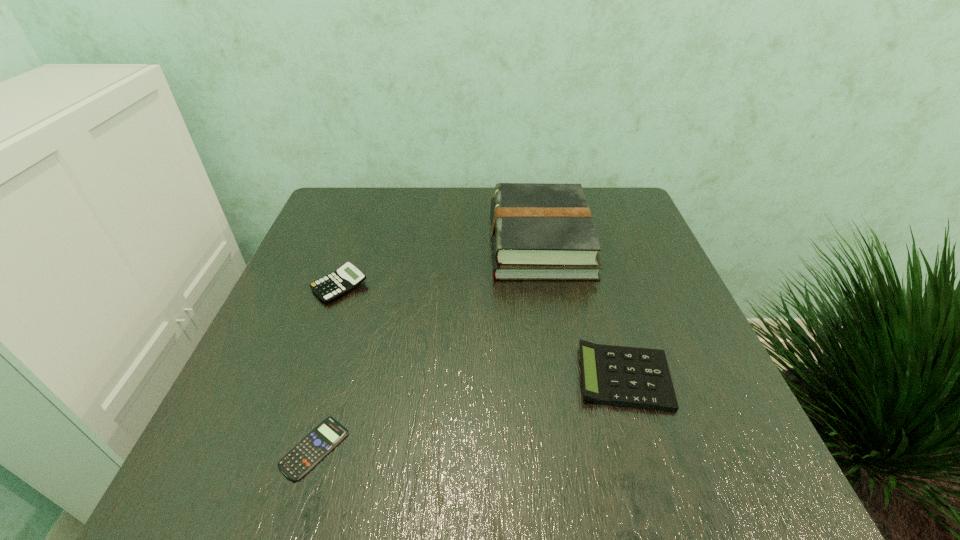
Find the location of a particular element. Image resolution: width=960 pixels, height=540 pixels. the tallest object is located at coordinates (539, 231).

Locate an element on the screen. The width and height of the screenshot is (960, 540). the farthest calculator is located at coordinates (348, 277).

Find the location of a particular element. the third farthest object is located at coordinates (634, 377).

The image size is (960, 540). Find the location of `the rightmost calculator`. the rightmost calculator is located at coordinates (634, 377).

Locate an element on the screen. the shortest calculator is located at coordinates (307, 453).

Locate an element on the screen. the shortest object is located at coordinates (307, 453).

Where is `vacant position located 0.080m on the spine side of the tallest object`? This screenshot has height=540, width=960. vacant position located 0.080m on the spine side of the tallest object is located at coordinates (459, 241).

I want to click on free region located on the spine side of the tallest object, so click(397, 241).

Locate an element on the screen. The width and height of the screenshot is (960, 540). free space located 0.370m on the spine side of the tallest object is located at coordinates (341, 241).

Locate an element on the screen. The height and width of the screenshot is (540, 960). vacant space positioned 0.060m on the back of the farthest calculator is located at coordinates (351, 252).